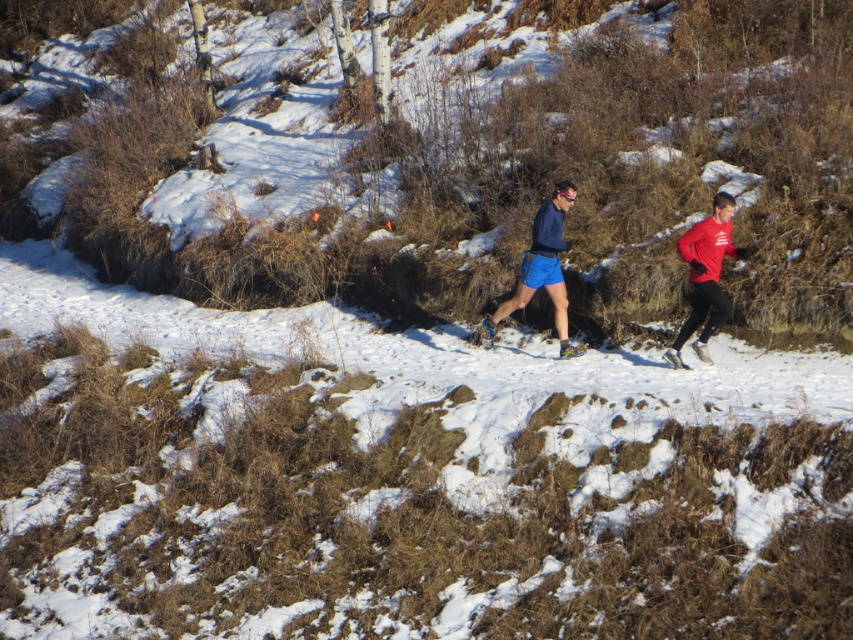
Question: Is matte blue shorts at center positioned before red matte running suit at right?

Choices:
 (A) yes
 (B) no

Answer: (B)

Question: Observing the image, what is the correct spatial positioning of matte blue shorts at center in reference to red matte running suit at right?

Choices:
 (A) left
 (B) right

Answer: (B)

Question: Which point is closer to the camera?

Choices:
 (A) (718, 308)
 (B) (553, 300)

Answer: (A)

Question: Which object appears farthest from the camera in this image?

Choices:
 (A) blue matte shorts at center
 (B) red matte running suit at right
 (C) matte blue shorts at center

Answer: (A)

Question: From the image, what is the correct spatial relationship of matte blue shorts at center in relation to blue matte shorts at center?

Choices:
 (A) above
 (B) below

Answer: (A)

Question: Which of the following is the closest to the observer?

Choices:
 (A) (694, 248)
 (B) (550, 236)

Answer: (A)